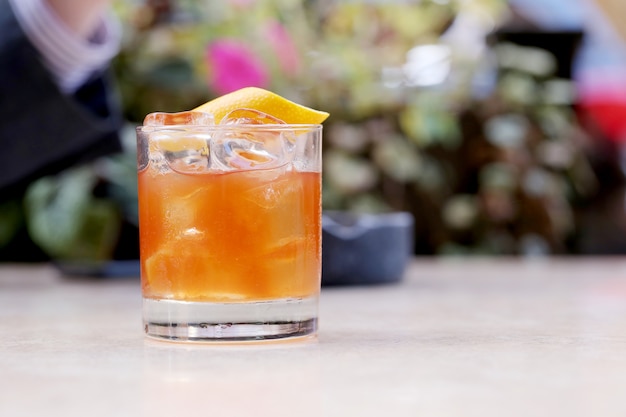
Find the location of `table`. table is located at coordinates (54, 331), (263, 367), (491, 345).